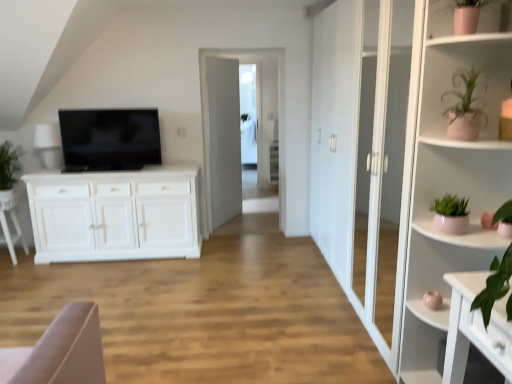
Question: Is pink ceramic plant at right, which is the first shelf in bottom-to-top order, positioned before pink ceramic vase at upper right, which is the first shelf in top-to-bottom order?

Choices:
 (A) no
 (B) yes

Answer: (B)

Question: Are pink ceramic plant at right, which is the first shelf in bottom-to-top order, and pink ceramic vase at upper right, the 2th shelf in the bottom-to-top sequence, beside each other?

Choices:
 (A) no
 (B) yes

Answer: (A)

Question: From a real-world perspective, is pink ceramic plant at right, which is the first shelf in bottom-to-top order, physically above pink ceramic vase at upper right, the 2th shelf in the bottom-to-top sequence?

Choices:
 (A) yes
 (B) no

Answer: (B)

Question: Can you confirm if pink ceramic plant at right, which is the first shelf in bottom-to-top order, is bigger than pink ceramic vase at upper right, which is the first shelf in top-to-bottom order?

Choices:
 (A) no
 (B) yes

Answer: (B)

Question: Is pink ceramic plant at right, which is the first shelf in bottom-to-top order, oriented towards pink ceramic vase at upper right, the 2th shelf in the bottom-to-top sequence?

Choices:
 (A) no
 (B) yes

Answer: (B)

Question: From the image's perspective, is transparent glass door at center above or below pink ceramic plant at right, which is the first shelf in bottom-to-top order?

Choices:
 (A) below
 (B) above

Answer: (B)

Question: Relative to pink ceramic plant at right, which is the first shelf in bottom-to-top order, is transparent glass door at center in front or behind?

Choices:
 (A) behind
 (B) front

Answer: (A)

Question: Based on their sizes in the image, would you say transparent glass door at center is bigger or smaller than pink ceramic plant at right, which is the first shelf in bottom-to-top order?

Choices:
 (A) small
 (B) big

Answer: (A)

Question: From a real-world perspective, is transparent glass door at center positioned above or below pink ceramic plant at right, which is the 2th shelf from top to bottom?

Choices:
 (A) above
 (B) below

Answer: (A)

Question: From the image's perspective, is pink ceramic plant at right, which is the first shelf in bottom-to-top order, above or below white wooden door at center?

Choices:
 (A) below
 (B) above

Answer: (A)

Question: Is pink ceramic plant at right, which is the first shelf in bottom-to-top order, situated inside white wooden door at center or outside?

Choices:
 (A) inside
 (B) outside

Answer: (B)

Question: Would you say pink ceramic plant at right, which is the first shelf in bottom-to-top order, is to the left or to the right of white wooden door at center in the picture?

Choices:
 (A) right
 (B) left

Answer: (A)

Question: Is pink ceramic plant at right, which is the 2th shelf from top to bottom, in front of or behind white wooden door at center in the image?

Choices:
 (A) behind
 (B) front

Answer: (B)

Question: Do you think pink ceramic vase at upper right, the 2th shelf in the bottom-to-top sequence, is within pink ceramic plant at upper right, or outside of it?

Choices:
 (A) inside
 (B) outside

Answer: (B)

Question: From the image's perspective, is pink ceramic vase at upper right, which is the first shelf in top-to-bottom order, positioned above or below pink ceramic plant at upper right?

Choices:
 (A) above
 (B) below

Answer: (A)